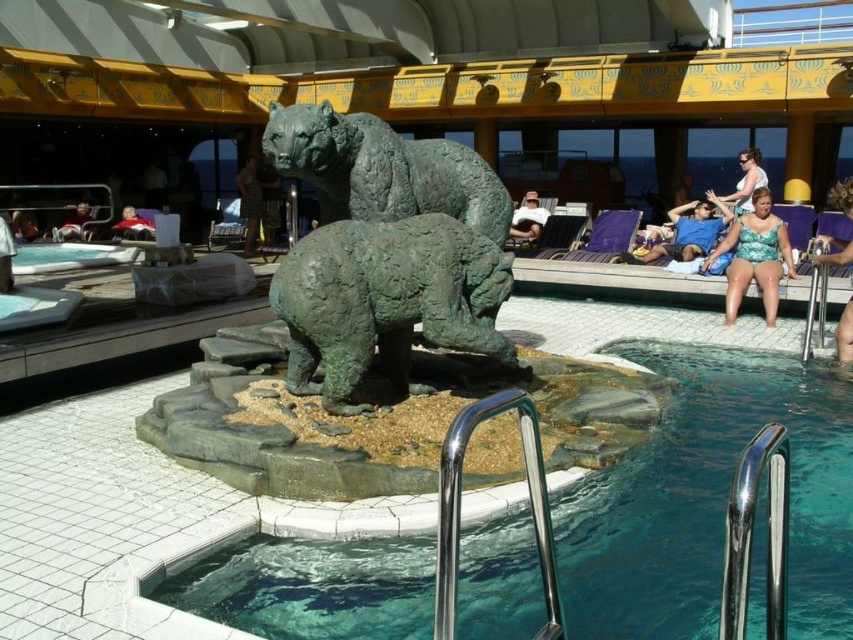
You are standing on the deck of the pool area and want to take a photo of the green patina bear at center. If your camera has a maximum zoom range of 5 meters, will you be able to capture a clear photo without moving closer?

The green patina bear at center is 6.79 meters away from the viewer. Since the camera can only zoom up to 5 meters, you won not be able to capture a clear photo without moving closer.

You are standing at the edge of the pool deck and want to reach a specific point marked at coordinates point (461, 227). Given that the pool deck is 25 feet long from your current position, can you safely walk to that point without exceeding the deck length?

The distance of point (461, 227) from viewer is 24.41 feet, which is within the 25 feet length of the pool deck. Therefore, you can safely walk to that point without exceeding the deck length.

You are a swimmer trying to reach the teal glassy water at center. The matte green statue at center is blocking your path. Which direction should you move to get to the water?

The teal glassy water at center is to the left of the matte green statue at center, so you should move to the left to reach the water.